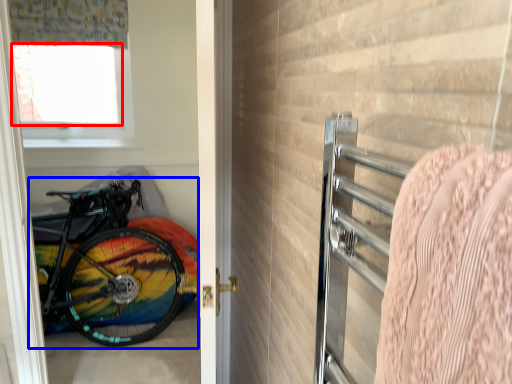
Question: Which object is closer to the camera taking this photo, window screen (highlighted by a red box) or bicycle (highlighted by a blue box)?

Choices:
 (A) window screen
 (B) bicycle

Answer: (B)